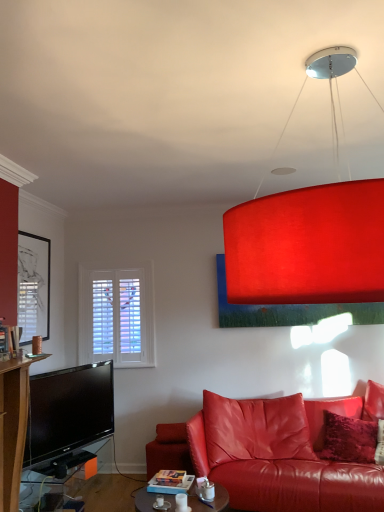
Question: Is velvet red pillow at lower right aimed at matte black tv stand at lower left, which appears as the first table when viewed from the left?

Choices:
 (A) no
 (B) yes

Answer: (A)

Question: Can matte black tv stand at lower left, the second table viewed from the right, be found inside velvet red pillow at lower right?

Choices:
 (A) yes
 (B) no

Answer: (B)

Question: Can you confirm if velvet red pillow at lower right is bigger than matte black tv stand at lower left, which appears as the first table when viewed from the left?

Choices:
 (A) no
 (B) yes

Answer: (A)

Question: From a real-world perspective, is velvet red pillow at lower right on matte black tv stand at lower left, which appears as the first table when viewed from the left?

Choices:
 (A) yes
 (B) no

Answer: (A)

Question: Does velvet red pillow at lower right have a smaller size compared to matte black tv stand at lower left, which appears as the first table when viewed from the left?

Choices:
 (A) no
 (B) yes

Answer: (B)

Question: Is velvet red pillow at lower right next to matte black tv stand at lower left, which appears as the first table when viewed from the left?

Choices:
 (A) no
 (B) yes

Answer: (A)

Question: Is matte black tv stand at lower left, the second table viewed from the right, facing towards velvet red pillow at lower right?

Choices:
 (A) yes
 (B) no

Answer: (A)

Question: Is matte black tv stand at lower left, which appears as the first table when viewed from the left, bigger than velvet red pillow at lower right?

Choices:
 (A) no
 (B) yes

Answer: (B)

Question: Is matte black tv stand at lower left, which appears as the first table when viewed from the left, further to camera compared to velvet red pillow at lower right?

Choices:
 (A) yes
 (B) no

Answer: (B)

Question: Does matte black tv stand at lower left, which appears as the first table when viewed from the left, have a lesser height compared to velvet red pillow at lower right?

Choices:
 (A) yes
 (B) no

Answer: (A)

Question: Considering the relative positions of matte black tv stand at lower left, which appears as the first table when viewed from the left, and velvet red pillow at lower right in the image provided, is matte black tv stand at lower left, which appears as the first table when viewed from the left, to the left of velvet red pillow at lower right from the viewer's perspective?

Choices:
 (A) no
 (B) yes

Answer: (B)

Question: From the image's perspective, is matte black tv stand at lower left, which appears as the first table when viewed from the left, located beneath velvet red pillow at lower right?

Choices:
 (A) no
 (B) yes

Answer: (B)

Question: Is matte black picture frame at left at the back of velvet red pillow at lower right?

Choices:
 (A) no
 (B) yes

Answer: (A)